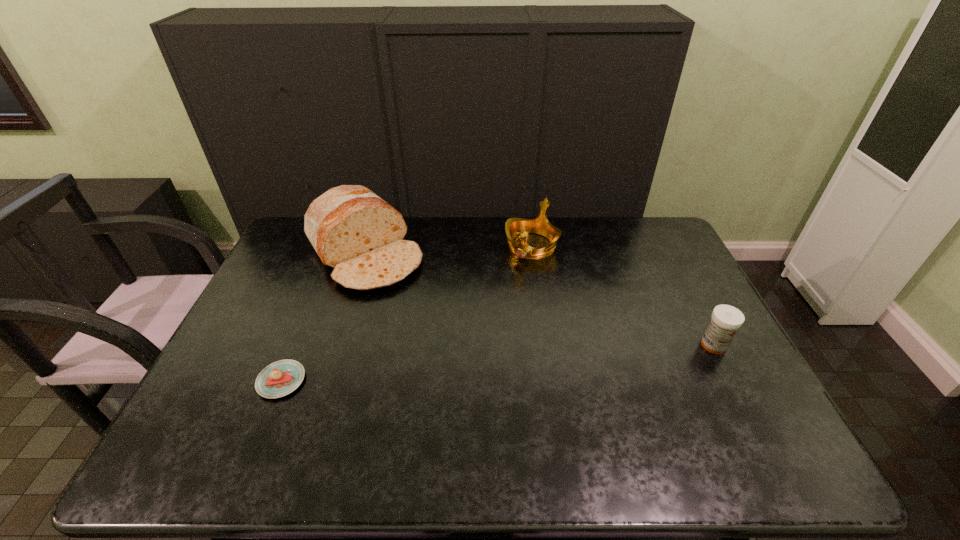
Find the location of a particular element. The image size is (960, 540). object located in the far left corner section of the desktop is located at coordinates (355, 232).

At what (x,y) coordinates should I click in order to perform the action: click on object situated at the near left corner. Please return your answer as a coordinate pair (x, y). The width and height of the screenshot is (960, 540). Looking at the image, I should click on (282, 377).

The height and width of the screenshot is (540, 960). Identify the location of free spot at the far edge of the desktop. (444, 237).

This screenshot has width=960, height=540. Identify the location of vacant space at the near edge. (543, 423).

Identify the location of free space at the right edge of the desktop. This screenshot has height=540, width=960. (674, 306).

I want to click on vacant space at the far left corner, so click(285, 253).

Find the location of `free space at the near left corner of the desktop`. free space at the near left corner of the desktop is located at coordinates (215, 426).

In the image, there is a desktop. In order to click on free space at the far right corner in this screenshot , I will do `click(638, 239)`.

Locate an element on the screen. This screenshot has height=540, width=960. empty space between the nearest object and the bread is located at coordinates [323, 317].

This screenshot has height=540, width=960. Identify the location of vacant area that lies between the pastry and the rightmost object. (497, 363).